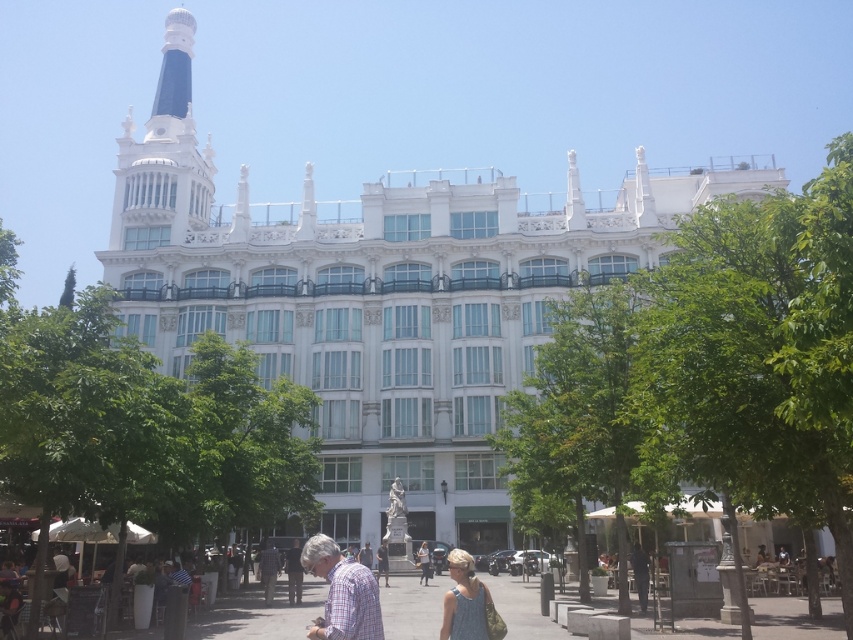
Does light gray fabric jacket at center appear on the left side of dark brown leather jacket at lower center?

Indeed, light gray fabric jacket at center is positioned on the left side of dark brown leather jacket at lower center.

Is point (277, 561) closer to camera compared to point (288, 563)?

No, it is not.

Between point (279, 566) and point (292, 579), which one is positioned behind?

The point (279, 566) is more distant.

What are the coordinates of `light gray fabric jacket at center` in the screenshot? It's located at (268, 570).

Is checkered fabric shirt at center thinner than dark blue shirt at center?

No.

Is checkered fabric shirt at center shorter than dark blue shirt at center?

In fact, checkered fabric shirt at center may be taller than dark blue shirt at center.

What do you see at coordinates (341, 593) in the screenshot? I see `checkered fabric shirt at center` at bounding box center [341, 593].

The width and height of the screenshot is (853, 640). In order to click on checkered fabric shirt at center in this screenshot , I will do `click(341, 593)`.

Is white glossy building at center wider than dark brown leather jacket at lower center?

Indeed, white glossy building at center has a greater width compared to dark brown leather jacket at lower center.

Where is `white glossy building at center`? white glossy building at center is located at coordinates (378, 298).